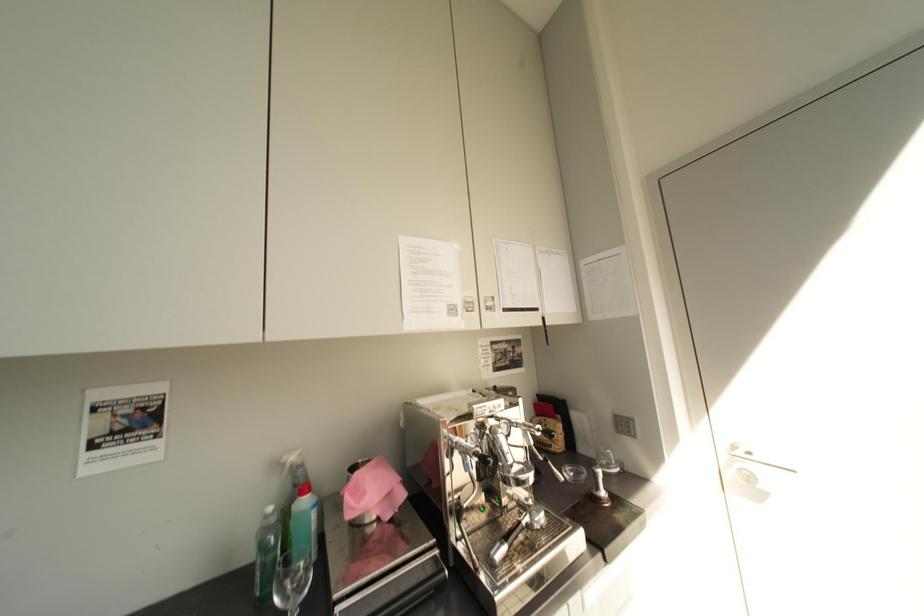
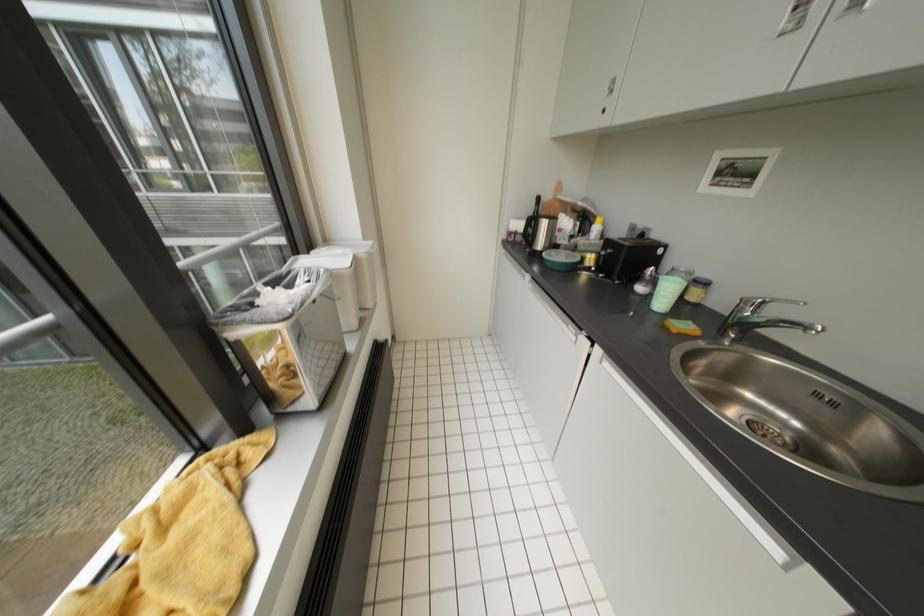
First-person continuous shooting, in which direction is the camera rotating?

The rotation direction of the camera is left-down.